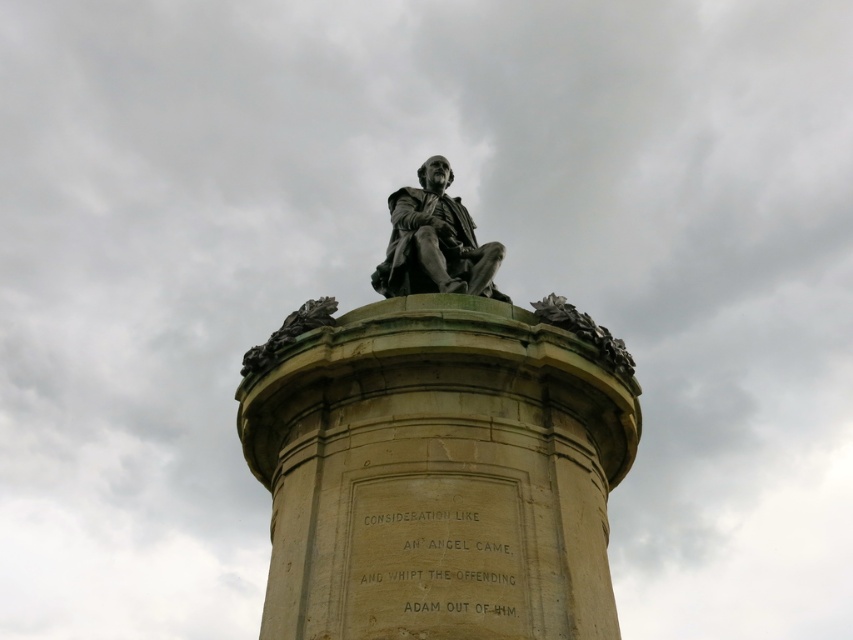
You are an architect designing a pathway that must pass between the stone column at center and the bronze statue at center. The pathway needs to be at least 40 feet wide to accommodate large vehicles. Based on the scene, can the pathway be constructed as planned?

The stone column at center is 37.35 feet from the bronze statue at center. Since the required pathway width is 40 feet, which is wider than the available space between them, the pathway cannot be constructed as planned.

You are standing in front of the statue and want to touch both the stone column at center and the bronze statue at center. Which one can you reach first without moving your position?

The stone column at center is closer to the viewer than the bronze statue at center, so you can reach the stone column at center first without moving your position.

What is the location of the point with coordinates [438,474] in the image?

The point with coordinates [438,474] is located on the stone column at center.